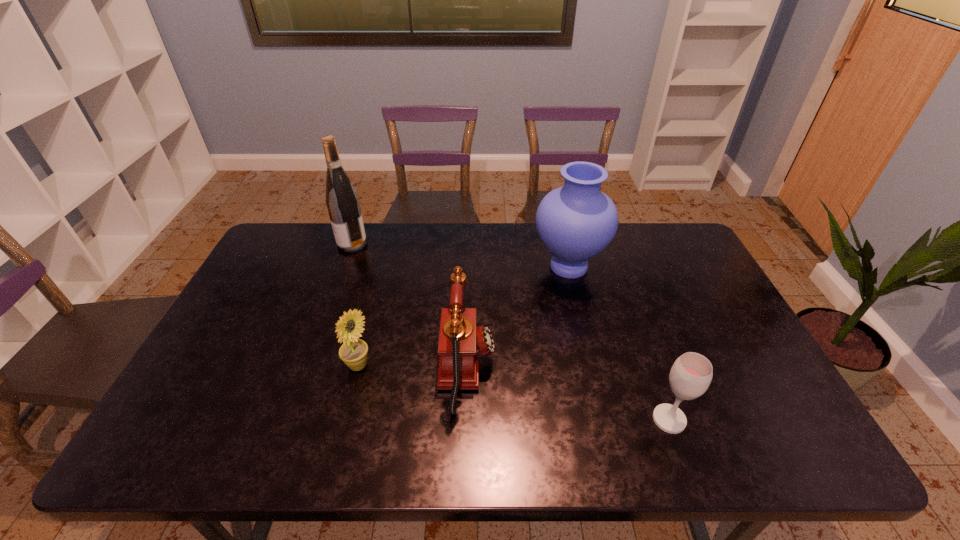
Find the location of a particular element. The height and width of the screenshot is (540, 960). the leftmost object is located at coordinates (342, 201).

Find the location of a particular element. The height and width of the screenshot is (540, 960). vase is located at coordinates (576, 222).

The height and width of the screenshot is (540, 960). In order to click on telephone in this screenshot , I will do `click(460, 339)`.

The height and width of the screenshot is (540, 960). I want to click on the third tallest object, so click(x=460, y=339).

You are a GUI agent. You are given a task and a screenshot of the screen. Output one action in this format:
    pyautogui.click(x=<x>, y=<y>)
    Task: Click on the wineglass
    The height and width of the screenshot is (540, 960).
    Given the screenshot: What is the action you would take?
    pyautogui.click(x=690, y=376)

Where is `the fourth object from right to left`? the fourth object from right to left is located at coordinates (353, 352).

Locate an element on the screen. The image size is (960, 540). vacant point located on the left of the wine bottle is located at coordinates (324, 244).

Identify the location of vacant space located on the left of the vase. pyautogui.click(x=461, y=266).

At what (x,y) coordinates should I click in order to perform the action: click on free spot located on the dial of the third object from right to left. Please return your answer as a coordinate pair (x, y). The image size is (960, 540). Looking at the image, I should click on (618, 369).

Locate an element on the screen. The height and width of the screenshot is (540, 960). free space located on the right of the wineglass is located at coordinates (776, 420).